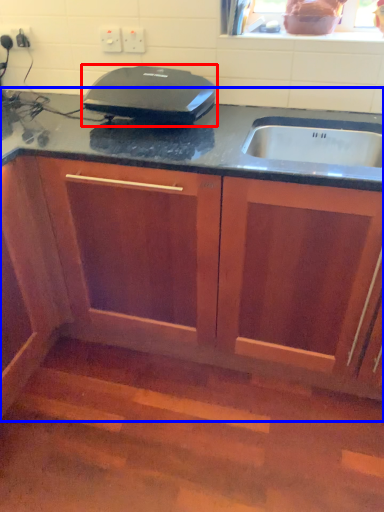
Question: Among these objects, which one is nearest to the camera, home appliance (highlighted by a red box) or cabinetry (highlighted by a blue box)?

Choices:
 (A) home appliance
 (B) cabinetry

Answer: (B)